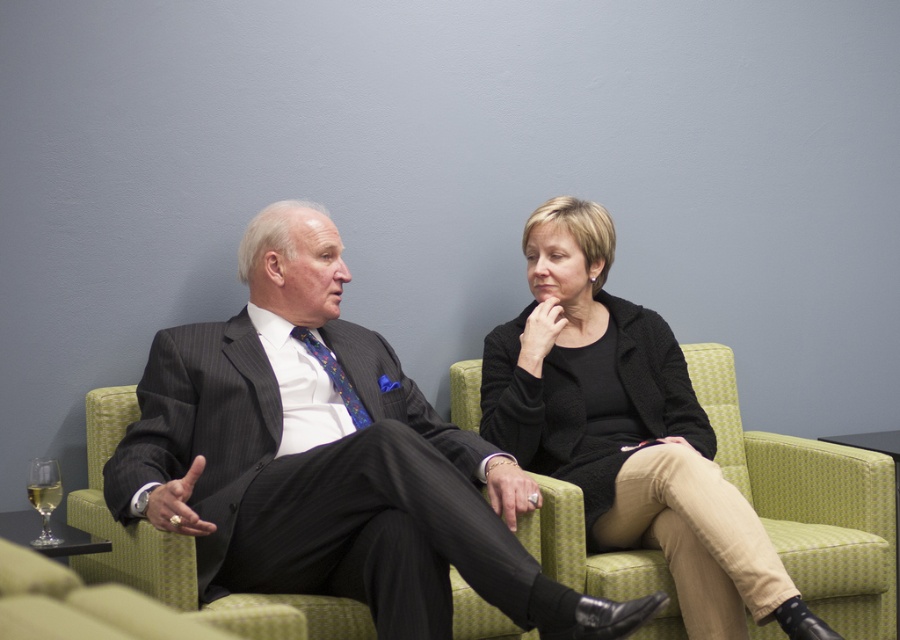
Who is more forward, (x=699, y=634) or (x=40, y=484)?

Point (x=40, y=484)

You are a GUI agent. You are given a task and a screenshot of the screen. Output one action in this format:
    pyautogui.click(x=<x>, y=<y>)
    Task: Click on the black woolen sweater at upper right
    This screenshot has width=900, height=640.
    Given the screenshot: What is the action you would take?
    pyautogui.click(x=627, y=429)

Which is more to the right, matte black suit at center or clear glass wine glass at lower left?

matte black suit at center is more to the right.

Who is shorter, matte black suit at center or clear glass wine glass at lower left?

clear glass wine glass at lower left

Between point (393, 618) and point (58, 474), which one is positioned behind?

Positioned behind is point (58, 474).

Where is `matte black suit at center`? matte black suit at center is located at coordinates (330, 460).

Does matte black suit at center appear over black woolen sweater at upper right?

No, matte black suit at center is not above black woolen sweater at upper right.

In the scene shown: Is matte black suit at center shorter than black woolen sweater at upper right?

Yes.

Which is behind, point (384, 600) or point (533, 244)?

Positioned behind is point (533, 244).

Find the location of a particular element. Image resolution: width=900 pixels, height=640 pixels. matte black suit at center is located at coordinates (330, 460).